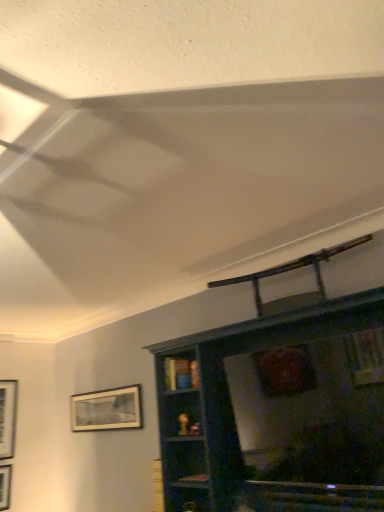
The width and height of the screenshot is (384, 512). What do you see at coordinates (289, 271) in the screenshot? I see `metallic silver swivel chair at upper center` at bounding box center [289, 271].

In order to face matte black picture frame at lower left, which is counted as the 2th picture frame, starting from the left, should I rotate leftwards or rightwards?

To align with it, rotate left about 11.796°.

In order to click on dark wood shelf at upper center in this screenshot , I will do pos(234,415).

Which of these two, matte black picture frame at lower left, which is counted as the 2th picture frame, starting from the left, or dark wood shelf at upper center, is bigger?

With larger size is dark wood shelf at upper center.

Based on the photo, does matte black picture frame at lower left, which is counted as the first picture frame, starting from the right, turn towards dark wood shelf at upper center?

No, matte black picture frame at lower left, which is counted as the first picture frame, starting from the right, is not turned towards dark wood shelf at upper center.

Is matte black picture frame at lower left, which is counted as the 2th picture frame, starting from the left, in front of or behind dark wood shelf at upper center in the image?

In the image, matte black picture frame at lower left, which is counted as the 2th picture frame, starting from the left, appears behind dark wood shelf at upper center.

Is point (13, 443) closer to viewer compared to point (200, 466)?

No, (13, 443) is further to viewer.

How far apart are matte black picture frame at left, the first picture frame in the left-to-right sequence, and dark wood shelf at upper center?

They are 7.57 feet apart.

This screenshot has width=384, height=512. I want to click on shelf that appears below the matte black picture frame at left, which is the second picture frame in right-to-left order (from a real-world perspective), so click(234, 415).

From a real-world perspective, relative to dark wood shelf at upper center, is metallic silver swivel chair at upper center vertically above or below?

In terms of real-world spatial position, metallic silver swivel chair at upper center is above dark wood shelf at upper center.

Does metallic silver swivel chair at upper center have a larger size compared to dark wood shelf at upper center?

Incorrect, metallic silver swivel chair at upper center is not larger than dark wood shelf at upper center.

Which object is positioned more to the right, metallic silver swivel chair at upper center or dark wood shelf at upper center?

Positioned to the right is metallic silver swivel chair at upper center.

Is matte black picture frame at lower left, which is counted as the first picture frame, starting from the right, oriented towards metallic silver swivel chair at upper center?

No, matte black picture frame at lower left, which is counted as the first picture frame, starting from the right, is not facing towards metallic silver swivel chair at upper center.

Which of these two, matte black picture frame at lower left, which is counted as the first picture frame, starting from the right, or metallic silver swivel chair at upper center, is thinner?

matte black picture frame at lower left, which is counted as the first picture frame, starting from the right, is thinner.

From the image's perspective, which one is positioned higher, matte black picture frame at lower left, which is counted as the first picture frame, starting from the right, or metallic silver swivel chair at upper center?

metallic silver swivel chair at upper center is shown above in the image.

Looking at the image, does metallic silver swivel chair at upper center seem bigger or smaller compared to matte black picture frame at left, the first picture frame in the left-to-right sequence?

In the image, metallic silver swivel chair at upper center appears to be larger than matte black picture frame at left, the first picture frame in the left-to-right sequence.

From the image's perspective, between metallic silver swivel chair at upper center and matte black picture frame at left, the first picture frame in the left-to-right sequence, which one is located above?

metallic silver swivel chair at upper center, from the image's perspective.

Considering the sizes of metallic silver swivel chair at upper center and matte black picture frame at left, the first picture frame in the left-to-right sequence, in the image, is metallic silver swivel chair at upper center wider or thinner than matte black picture frame at left, the first picture frame in the left-to-right sequence,?

metallic silver swivel chair at upper center is wider than matte black picture frame at left, the first picture frame in the left-to-right sequence.

Could you tell me if metallic silver swivel chair at upper center is facing matte black picture frame at left, the first picture frame in the left-to-right sequence?

No, metallic silver swivel chair at upper center is not aimed at matte black picture frame at left, the first picture frame in the left-to-right sequence.

Could matte black picture frame at left, the first picture frame in the left-to-right sequence, be considered to be inside dark wood shelf at upper center?

Definitely not — matte black picture frame at left, the first picture frame in the left-to-right sequence, is not inside dark wood shelf at upper center.

Based on their sizes in the image, would you say dark wood shelf at upper center is bigger or smaller than matte black picture frame at left, which is the second picture frame in right-to-left order?

Clearly, dark wood shelf at upper center is larger in size than matte black picture frame at left, which is the second picture frame in right-to-left order.

How different are the orientations of dark wood shelf at upper center and matte black picture frame at left, the first picture frame in the left-to-right sequence, in degrees?

dark wood shelf at upper center and matte black picture frame at left, the first picture frame in the left-to-right sequence, are facing 89.6 degrees away from each other.

From the image's perspective, who appears lower, dark wood shelf at upper center or matte black picture frame at left, the first picture frame in the left-to-right sequence?

matte black picture frame at left, the first picture frame in the left-to-right sequence, appears lower in the image.

Considering the relative positions of dark wood shelf at upper center and metallic silver swivel chair at upper center in the image provided, is dark wood shelf at upper center to the left of metallic silver swivel chair at upper center from the viewer's perspective?

Yes.

You are a GUI agent. You are given a task and a screenshot of the screen. Output one action in this format:
    pyautogui.click(x=<x>, y=<y>)
    Task: Click on the shelf in front of the metallic silver swivel chair at upper center
    This screenshot has width=384, height=512.
    Given the screenshot: What is the action you would take?
    pyautogui.click(x=234, y=415)

From the image's perspective, which is below, dark wood shelf at upper center or metallic silver swivel chair at upper center?

dark wood shelf at upper center, from the image's perspective.

Starting from the dark wood shelf at upper center, which picture frame is the 1st one behind? Please provide its 2D coordinates.

[(107, 410)]

What are the coordinates of `the 2nd picture frame to the left of the dark wood shelf at upper center, starting your count from the anchor` in the screenshot? It's located at (8, 417).

Looking at the image, which one is located closer to matte black picture frame at lower left, which is counted as the 2th picture frame, starting from the left, metallic silver swivel chair at upper center or matte black picture frame at left, which is the second picture frame in right-to-left order?

Based on the image, matte black picture frame at left, which is the second picture frame in right-to-left order, appears to be nearer to matte black picture frame at lower left, which is counted as the 2th picture frame, starting from the left.

Which object lies further to the anchor point matte black picture frame at lower left, which is counted as the first picture frame, starting from the right, dark wood shelf at upper center or metallic silver swivel chair at upper center?

metallic silver swivel chair at upper center is positioned further to the anchor matte black picture frame at lower left, which is counted as the first picture frame, starting from the right.

Based on the photo, looking at the image, which one is located further to matte black picture frame at left, the first picture frame in the left-to-right sequence, metallic silver swivel chair at upper center or matte black picture frame at lower left, which is counted as the 2th picture frame, starting from the left?

metallic silver swivel chair at upper center.

Looking at the image, which one is located closer to dark wood shelf at upper center, matte black picture frame at lower left, which is counted as the first picture frame, starting from the right, or matte black picture frame at left, which is the second picture frame in right-to-left order?

Among the two, matte black picture frame at lower left, which is counted as the first picture frame, starting from the right, is located nearer to dark wood shelf at upper center.

Estimate the real-world distances between objects in this image. Which object is further from matte black picture frame at left, the first picture frame in the left-to-right sequence, metallic silver swivel chair at upper center or dark wood shelf at upper center?

metallic silver swivel chair at upper center.

Based on their spatial positions, is matte black picture frame at lower left, which is counted as the first picture frame, starting from the right, or matte black picture frame at left, the first picture frame in the left-to-right sequence, closer to metallic silver swivel chair at upper center?

matte black picture frame at lower left, which is counted as the first picture frame, starting from the right, is closer to metallic silver swivel chair at upper center.

From the picture: When comparing their distances from metallic silver swivel chair at upper center, does matte black picture frame at left, which is the second picture frame in right-to-left order, or dark wood shelf at upper center seem closer?

The object closer to metallic silver swivel chair at upper center is dark wood shelf at upper center.

Looking at the image, which one is located closer to matte black picture frame at left, the first picture frame in the left-to-right sequence, matte black picture frame at lower left, which is counted as the 2th picture frame, starting from the left, or dark wood shelf at upper center?

matte black picture frame at lower left, which is counted as the 2th picture frame, starting from the left, is positioned closer to the anchor matte black picture frame at left, the first picture frame in the left-to-right sequence.

Find the location of a particular element. This screenshot has width=384, height=512. swivel chair between dark wood shelf at upper center and matte black picture frame at lower left, which is counted as the first picture frame, starting from the right, from front to back is located at coordinates (289, 271).

Find the location of a particular element. The height and width of the screenshot is (512, 384). picture frame between dark wood shelf at upper center and matte black picture frame at left, which is the second picture frame in right-to-left order, from front to back is located at coordinates (107, 410).

Locate an element on the screen. swivel chair located between dark wood shelf at upper center and matte black picture frame at left, which is the second picture frame in right-to-left order, in the depth direction is located at coordinates (289, 271).

The width and height of the screenshot is (384, 512). In order to click on picture frame located between matte black picture frame at left, which is the second picture frame in right-to-left order, and metallic silver swivel chair at upper center in the left-right direction in this screenshot , I will do `click(107, 410)`.